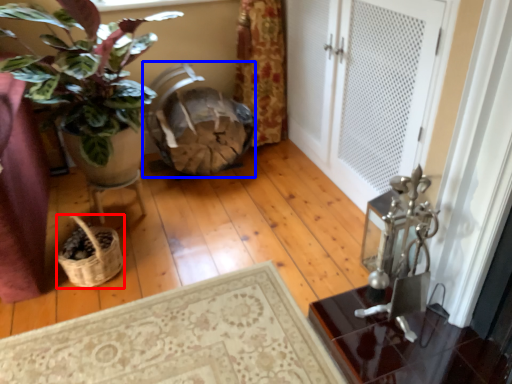
Question: Which of the following is the farthest to the observer, basket (highlighted by a red box) or rocking chair (highlighted by a blue box)?

Choices:
 (A) basket
 (B) rocking chair

Answer: (B)